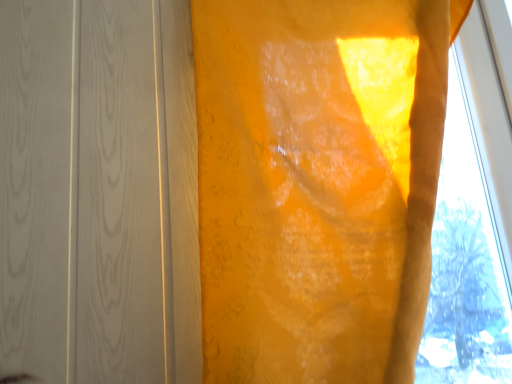
This screenshot has height=384, width=512. Describe the element at coordinates (317, 184) in the screenshot. I see `translucent yellow fabric at center` at that location.

This screenshot has height=384, width=512. I want to click on translucent yellow fabric at center, so click(317, 184).

Find the location of a particular element. The height and width of the screenshot is (384, 512). translucent yellow fabric at center is located at coordinates (317, 184).